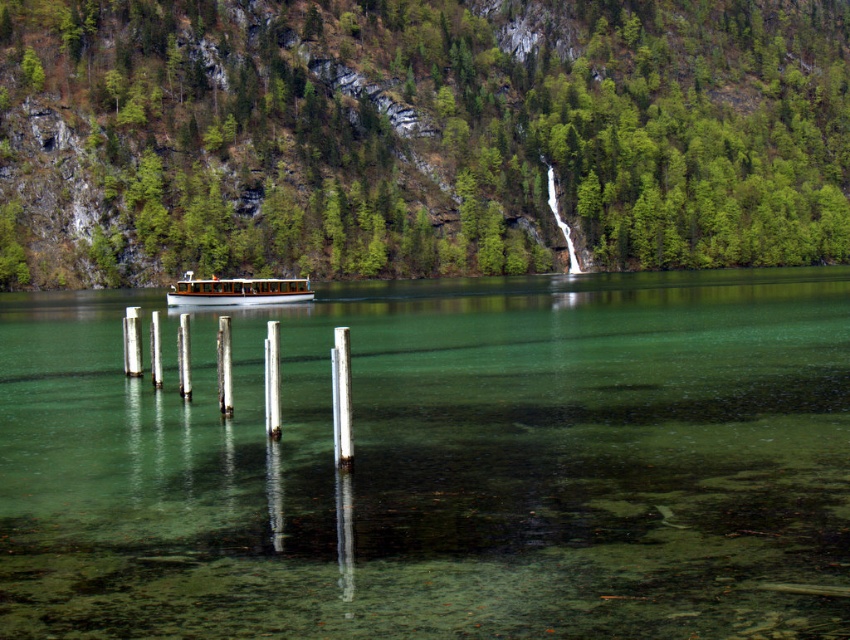
Does green forested mountain at upper center lie behind white polished wood boat at center?

Yes, green forested mountain at upper center is further from the viewer.

Does green forested mountain at upper center have a greater height compared to white polished wood boat at center?

Correct, green forested mountain at upper center is much taller as white polished wood boat at center.

Who is more distant from viewer, (581,3) or (272,296)?

The point (581,3) is behind.

Where is `green forested mountain at upper center`? green forested mountain at upper center is located at coordinates (417, 136).

Image resolution: width=850 pixels, height=640 pixels. What are the coordinates of `clear water at center` in the screenshot? It's located at (438, 464).

The image size is (850, 640). What are the coordinates of `clear water at center` in the screenshot? It's located at (438, 464).

Image resolution: width=850 pixels, height=640 pixels. In order to click on clear water at center in this screenshot , I will do `click(438, 464)`.

Who is taller, clear water at center or white polished wood boat at center?

With more height is clear water at center.

Is clear water at center thinner than white polished wood boat at center?

No, clear water at center is not thinner than white polished wood boat at center.

Image resolution: width=850 pixels, height=640 pixels. What are the coordinates of `clear water at center` in the screenshot? It's located at (438, 464).